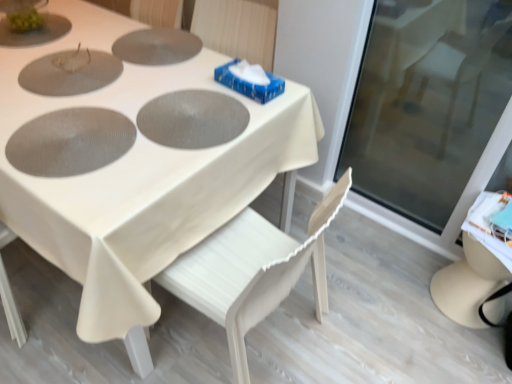
Where is `vacant space underneath matte gray pizza pan at center, which is counted as the 1th pizza pan, starting from the front (from a real-world perspective)`? vacant space underneath matte gray pizza pan at center, which is counted as the 1th pizza pan, starting from the front (from a real-world perspective) is located at coordinates pos(72,140).